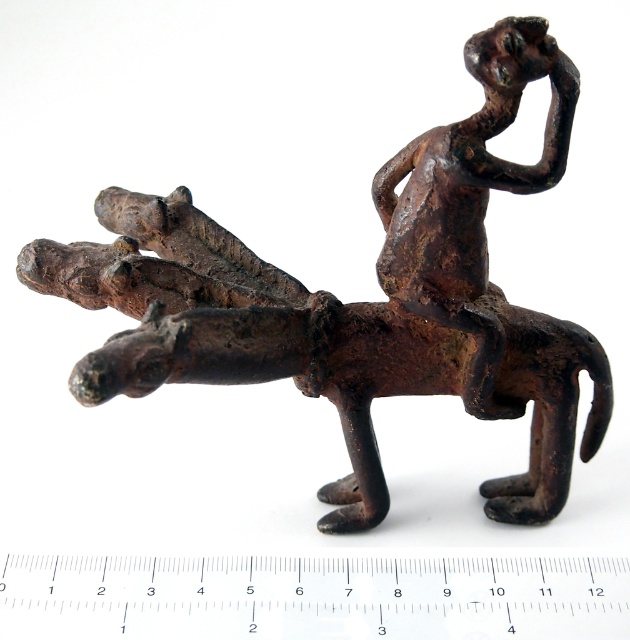
You are standing in front of the sculpture and want to touch the point at coordinates point (605,570). If your hand can reach up to 1 meter, will you be able to reach it?

The point (605,570) is 1.04 meters away from the viewer, which is slightly beyond your hand reach of 1 meter. Therefore, you cannot reach it.

You are an artist trying to sketch the sculpture. You notice the metallic ruler at center and the rusty metal figure at upper right. Which object should you draw first if you want to follow a left to right drawing sequence?

You should draw the metallic ruler at center first because it is positioned to the left of the rusty metal figure at upper right, so following a left to right sequence would start with the metallic ruler at center.